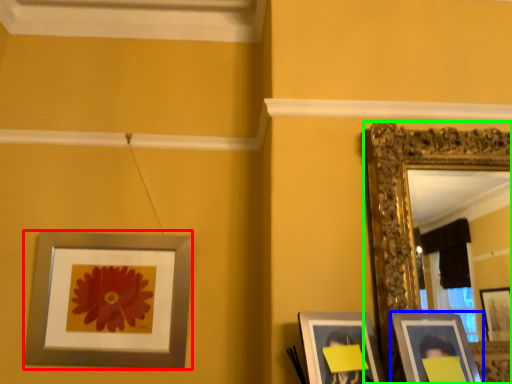
Question: Which object is positioned farthest from picture frame (highlighted by a red box)? Select from picture frame (highlighted by a blue box) and picture frame (highlighted by a green box).

Choices:
 (A) picture frame
 (B) picture frame

Answer: (A)